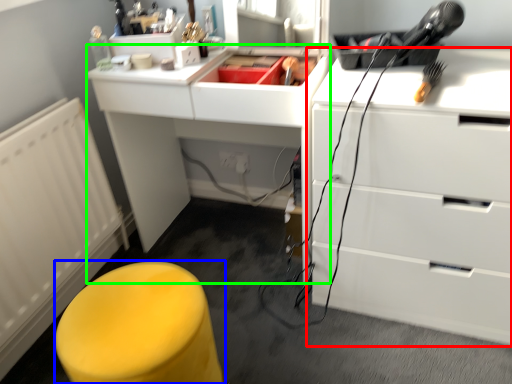
Question: Which is nearer to the chest of drawers (highlighted by a red box)? furniture (highlighted by a blue box) or computer desk (highlighted by a green box).

Choices:
 (A) furniture
 (B) computer desk

Answer: (B)